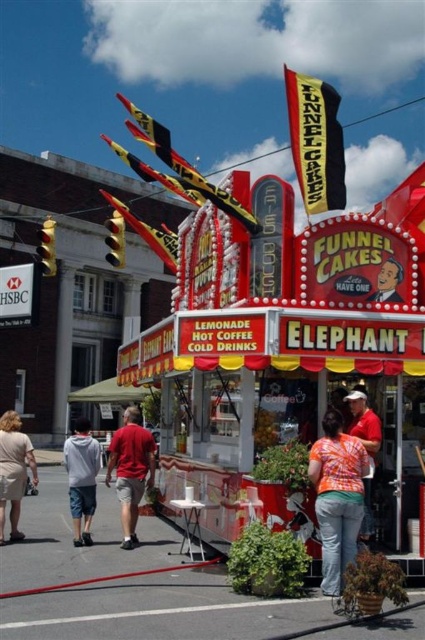
Question: Which point is closer to the camera?

Choices:
 (A) orange printed shirt at center
 (B) matte red shirt at center
 (C) gray hoodie at lower left
 (D) orange tie-dye shirt at center

Answer: (A)

Question: Among these points, which one is farthest from the camera?

Choices:
 (A) (16, 508)
 (B) (350, 529)

Answer: (A)

Question: Is gray hoodie at lower left wider than orange printed shirt at center?

Choices:
 (A) no
 (B) yes

Answer: (B)

Question: Which object is closer to the camera taking this photo?

Choices:
 (A) orange tie-dye shirt at center
 (B) smooth plastic sign at center
 (C) beige fabric dress at lower left
 (D) gray hoodie at lower left

Answer: (A)

Question: Does orange tie-dye shirt at center have a greater width compared to matte red shirt at center?

Choices:
 (A) no
 (B) yes

Answer: (A)

Question: Is orange tie-dye shirt at center to the left of beige fabric dress at lower left from the viewer's perspective?

Choices:
 (A) no
 (B) yes

Answer: (A)